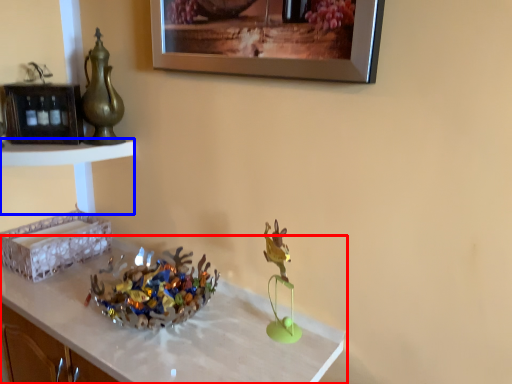
Question: Which object is further to the camera taking this photo, table (highlighted by a red box) or vanity (highlighted by a blue box)?

Choices:
 (A) table
 (B) vanity

Answer: (B)